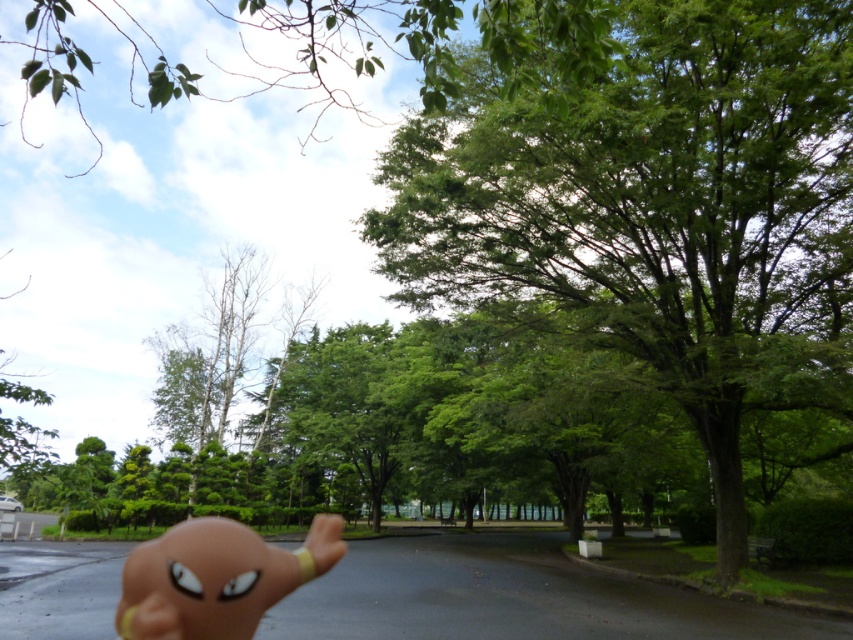
You are standing at the point labeled as point (x=212, y=588) and want to walk to the point labeled as point (x=619, y=33). Is there a clear path between these two points, or will you need to go around obstacles?

Since point (x=619, y=33) is behind point (x=212, y=588), there might be obstacles blocking the direct path between them. You should consider going around the obstacles to reach your destination.

You are standing in a park and see the green leafy tree at center. If you want to place a 3.00 meter long bench in front of it so that it faces the tree, will the bench fit between you and the tree?

The distance between you and the green leafy tree at center is 2.50 meters. Since the bench is 3.00 meters long, it will not fit in the available space between you and the tree.